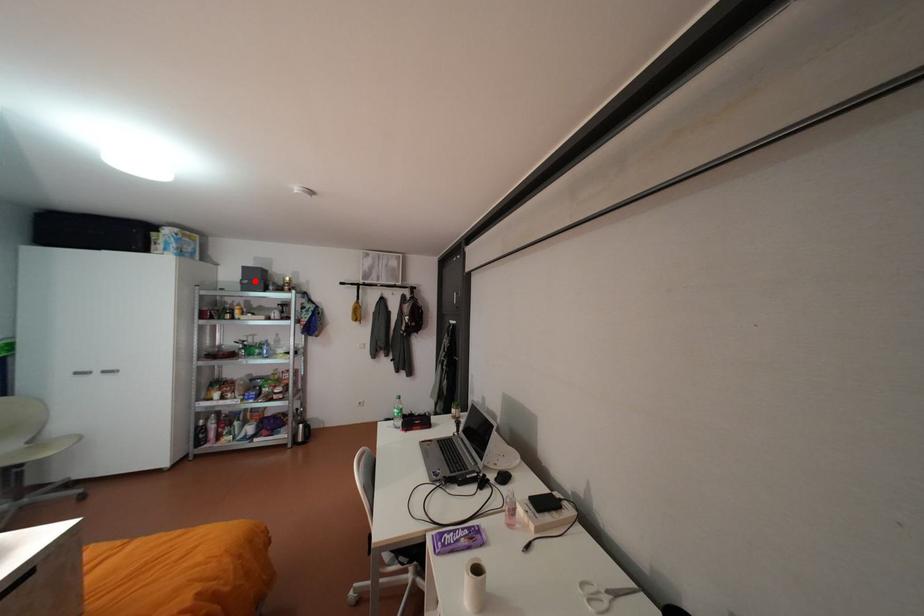
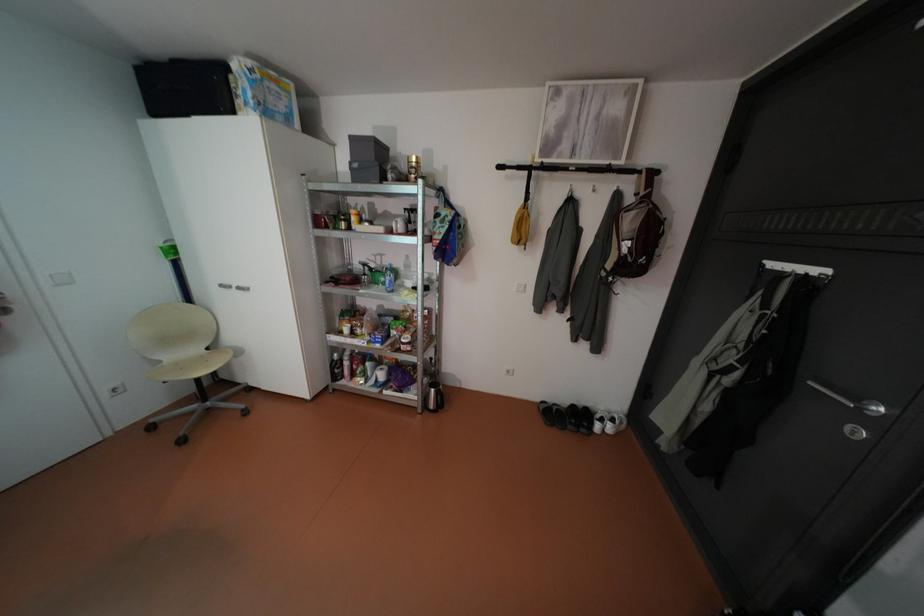
Where in the second image is the point corresponding to the highlighted location from the first image?

(365, 164)